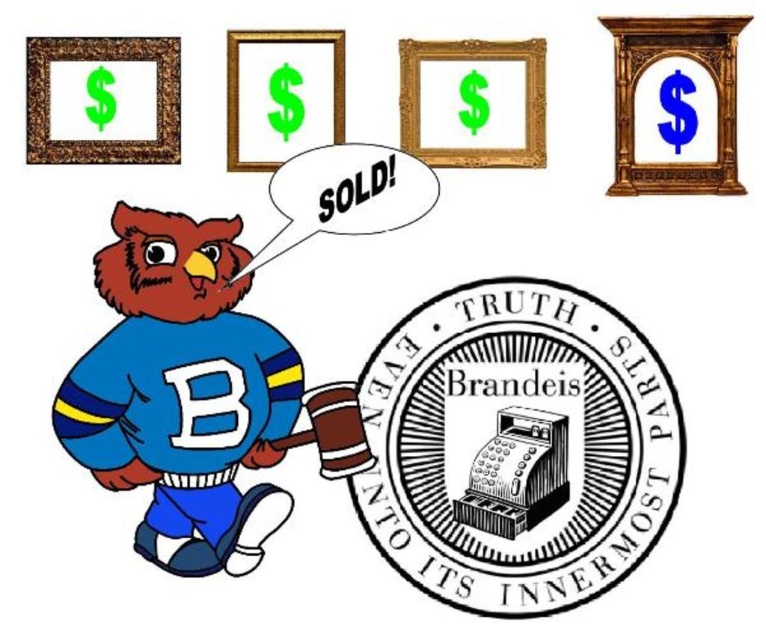
Can you confirm if black/white/ink cash register at center is smaller than gold/golden frame at upper center?

No.

Does black/white/ink cash register at center have a larger size compared to gold/golden frame at upper center?

Yes.

Find the location of a particular element. black/white/ink cash register at center is located at coordinates (503, 438).

Between green matte dollar sign at upper center and gold wooden frame at upper right, which one has less height?

Standing shorter between the two is green matte dollar sign at upper center.

Who is more distant from viewer, (277, 113) or (632, 134)?

Positioned behind is point (277, 113).

The width and height of the screenshot is (766, 640). What are the coordinates of `green matte dollar sign at upper center` in the screenshot? It's located at (280, 93).

Can you confirm if gold/golden frame at upper center is taller than green matte dollar sign at upper center?

No.

Is gold/golden frame at upper center to the right of green matte dollar sign at upper center from the viewer's perspective?

Yes, gold/golden frame at upper center is to the right of green matte dollar sign at upper center.

Find the location of a particular element. Image resolution: width=766 pixels, height=640 pixels. gold/golden frame at upper center is located at coordinates (473, 102).